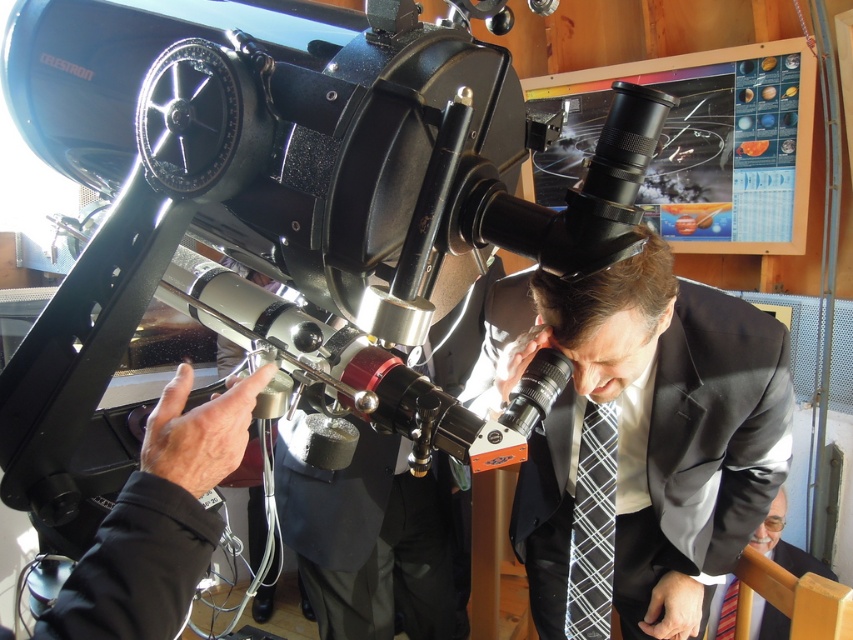
Consider the image. You are standing in the observatory and want to adjust the Celestron telescope to focus on a specific point in the image. The point you want to focus on is located at coordinates point (479, 301). If you are 2 meters away from the telescope, will you be able to reach the point by moving closer or farther away?

The distance of point (479, 301) from camera is 2.02 meters. Since you are currently 2 meters away from the telescope, you need to move slightly closer to reach the point at 2.02 meters.

You are an astronomer preparing for a presentation. You need to adjust the Celestron telescope to view a star located at coordinates matching the position of the black silk business suit at center. Can you align the telescope to that point?

The black silk business suit at center is located at point (378, 541). Therefore, you can align the Celestron telescope to those coordinates to view the star at that position.